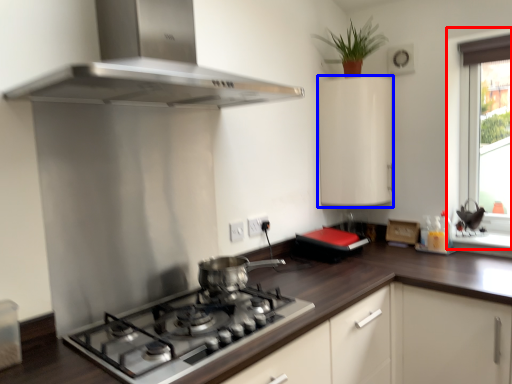
Question: Which of the following is the closest to the observer, window (highlighted by a red box) or cabinetry (highlighted by a blue box)?

Choices:
 (A) window
 (B) cabinetry

Answer: (A)